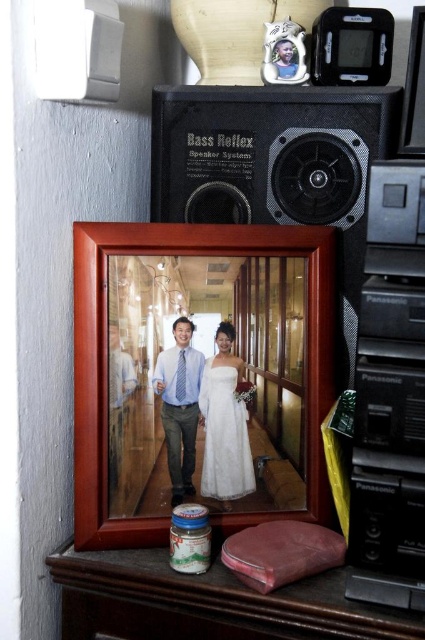
Question: Can you confirm if black matte speaker system at upper center is positioned above white lace dress at center?

Choices:
 (A) no
 (B) yes

Answer: (B)

Question: Does black matte speaker system at upper center appear under matte blue shirt at center?

Choices:
 (A) no
 (B) yes

Answer: (A)

Question: Which object appears closest to the camera in this image?

Choices:
 (A) brown leather wallet at lower center
 (B) white lace dress at center
 (C) matte blue shirt at center

Answer: (A)

Question: Which point appears closest to the camera in this image?

Choices:
 (A) (305, 156)
 (B) (232, 456)
 (C) (184, 440)
 (D) (175, 348)

Answer: (D)

Question: Does wooden photo frame at center have a smaller size compared to brown leather wallet at lower center?

Choices:
 (A) no
 (B) yes

Answer: (A)

Question: Which point appears farthest from the camera in this image?

Choices:
 (A) (159, 568)
 (B) (200, 118)

Answer: (B)